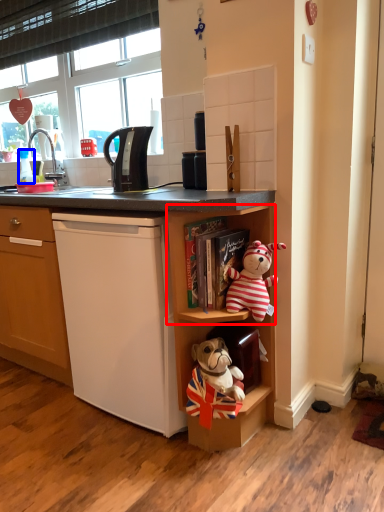
Question: Which of the following is the closest to the observer, shelf (highlighted by a red box) or coffee cup (highlighted by a blue box)?

Choices:
 (A) shelf
 (B) coffee cup

Answer: (A)